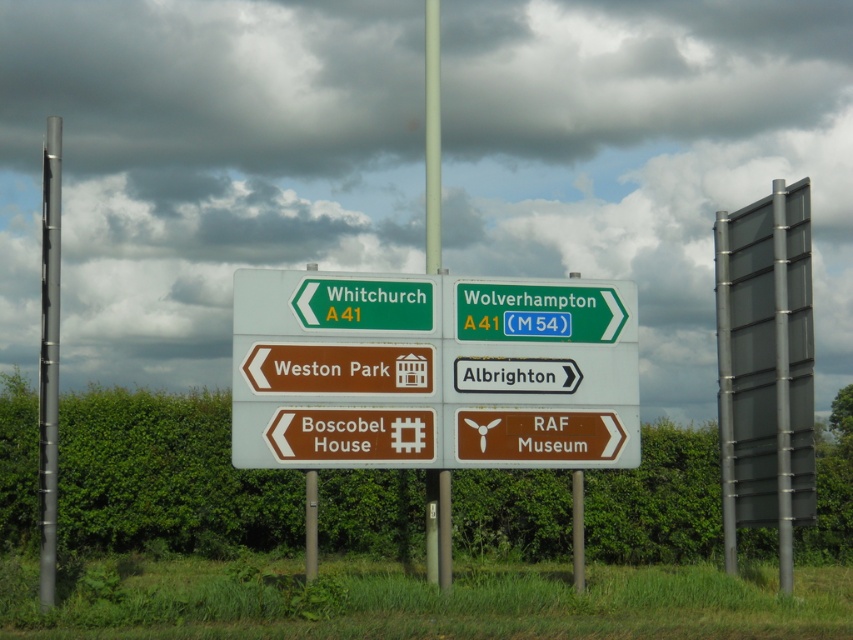
Which of these two, green plastic road sign at center or metallic gray pole at left, stands shorter?

Standing shorter between the two is green plastic road sign at center.

Is green plastic road sign at center behind metallic gray pole at left?

Yes.

This screenshot has height=640, width=853. Identify the location of green plastic road sign at center. (432, 371).

Find the location of a particular element. Image resolution: width=853 pixels, height=640 pixels. green plastic road sign at center is located at coordinates (432, 371).

Which is more to the right, green plastic sign at upper right or green matte sign at left?

green plastic sign at upper right

Which of these two, green plastic sign at upper right or green matte sign at left, stands taller?

green plastic sign at upper right

Who is more forward, (599, 288) or (392, 314)?

Point (392, 314) is in front.

Where is `green plastic sign at upper right`? green plastic sign at upper right is located at coordinates (538, 312).

From the picture: Is green plastic road sign at center above green plastic sign at upper right?

Actually, green plastic road sign at center is below green plastic sign at upper right.

Can you confirm if green plastic road sign at center is positioned below green plastic sign at upper right?

Yes.

Locate an element on the screen. green plastic road sign at center is located at coordinates (x=432, y=371).

This screenshot has height=640, width=853. I want to click on green plastic road sign at center, so click(432, 371).